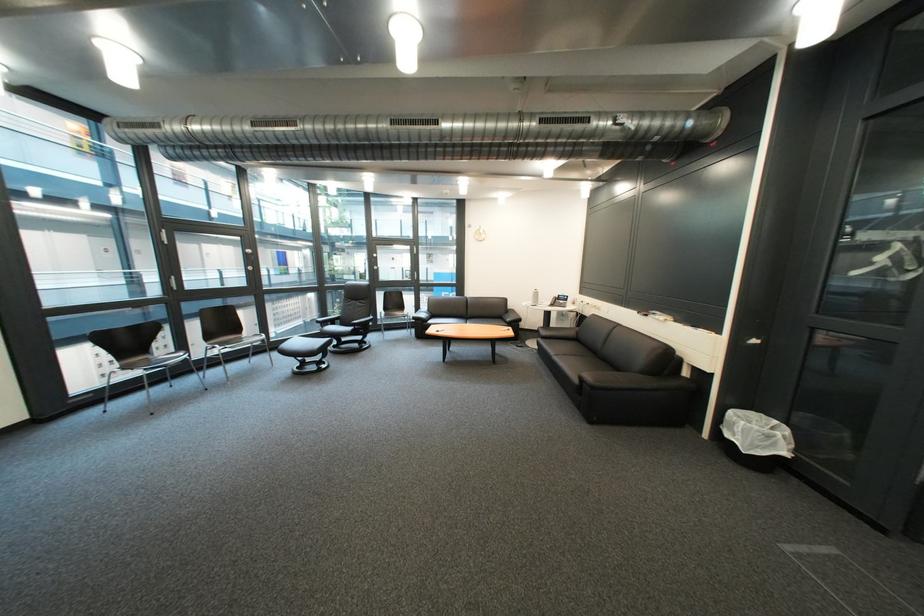
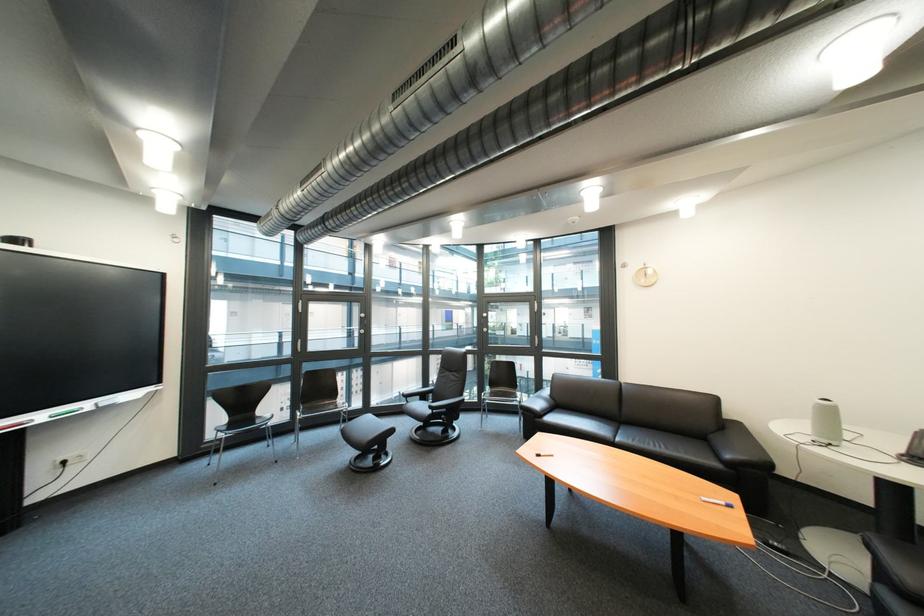
Locate, in the second image, the point that corresponds to the point at 436,315 in the first image.

(551, 406)